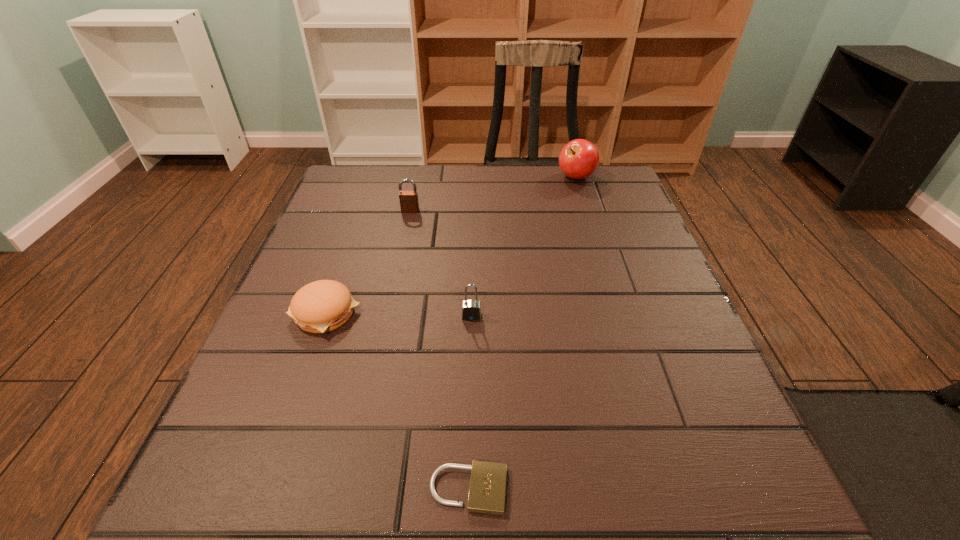
You are a GUI agent. You are given a task and a screenshot of the screen. Output one action in this format:
    pyautogui.click(x=<x>, y=<y>)
    Task: Click on the vacant space located on the front-facing side of the leftmost padlock
    The width and height of the screenshot is (960, 540).
    Given the screenshot: What is the action you would take?
    coord(405,237)

At what (x,y) coordinates should I click in order to perform the action: click on vacant position located on the shackle of the second nearest padlock. Please return your answer as a coordinate pair (x, y). Looking at the image, I should click on (470, 389).

Where is `vacant space positioned 0.150m on the back of the leftmost object`? vacant space positioned 0.150m on the back of the leftmost object is located at coordinates (350, 244).

Identify the location of vacant area situated 0.070m on the left of the shortest padlock. (378, 489).

The image size is (960, 540). I want to click on apple present at the far edge, so click(x=579, y=159).

What are the coordinates of `padlock located in the far edge section of the desktop` in the screenshot? It's located at (409, 203).

Find the location of a particular element. object present at the near edge is located at coordinates (487, 488).

Where is `object that is at the left edge`? object that is at the left edge is located at coordinates click(322, 306).

Find the location of a particular element. The width and height of the screenshot is (960, 540). object that is at the right edge is located at coordinates (579, 159).

You are a GUI agent. You are given a task and a screenshot of the screen. Output one action in this format:
    pyautogui.click(x=<x>, y=<y>)
    Task: Click on the object located at the far right corner
    This screenshot has width=960, height=540.
    Given the screenshot: What is the action you would take?
    pyautogui.click(x=579, y=159)